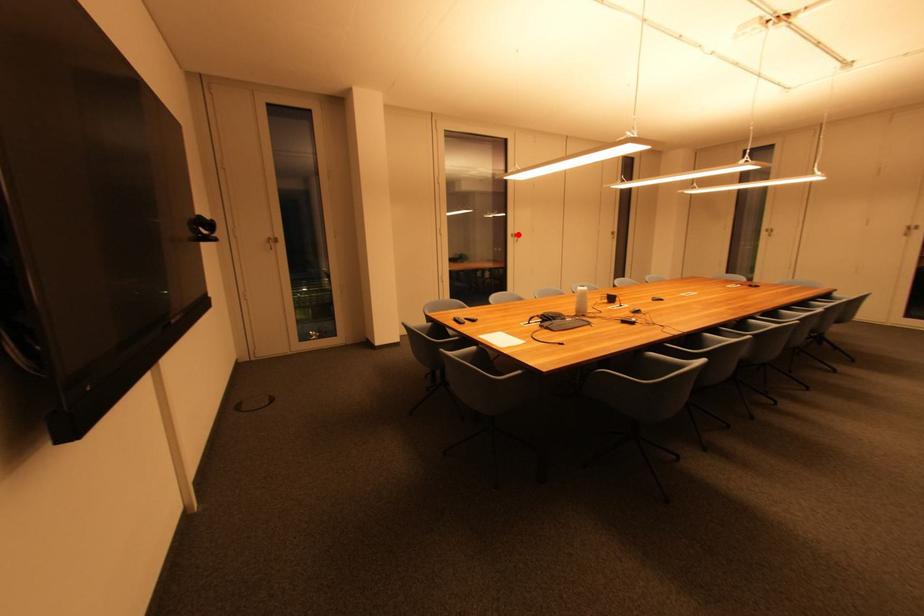
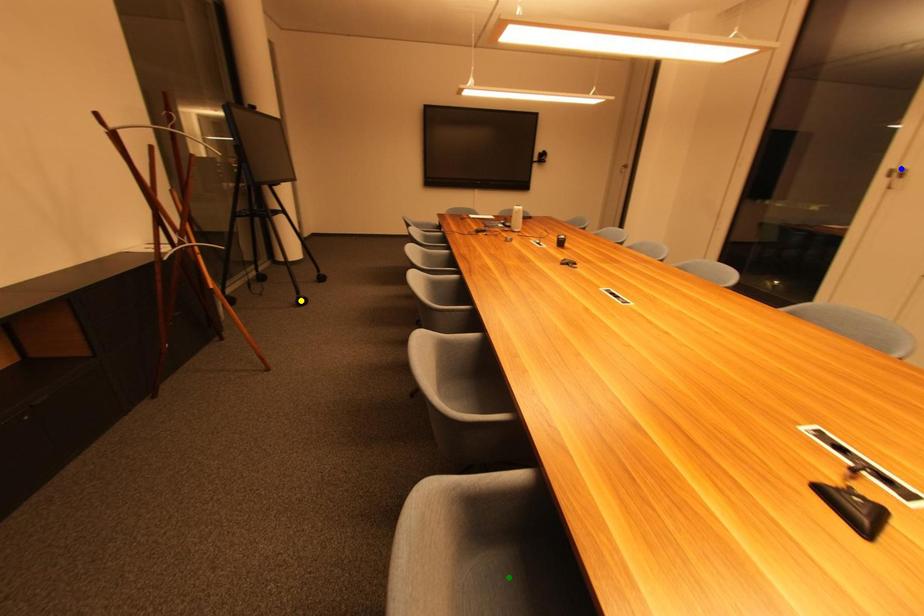
Question: I am providing you with two images of the same scene from different viewpoints. A red point is marked on the first image. You are given multiple points on the second image. Which mark in image 2 goes with the point in image 1?

Choices:
 (A) green point
 (B) blue point
 (C) yellow point

Answer: (B)